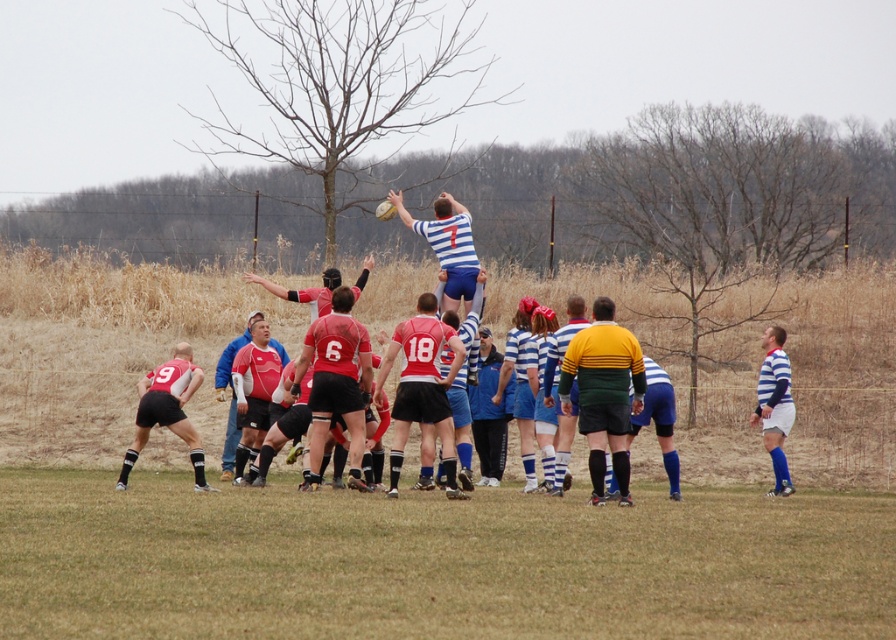
Based on the photo, can you confirm if striped jersey at center is wider than striped jersey at right?

Correct, the width of striped jersey at center exceeds that of striped jersey at right.

Does striped jersey at center appear on the right side of striped jersey at right?

In fact, striped jersey at center is to the left of striped jersey at right.

Which is behind, point (454, 225) or point (785, 483)?

Point (454, 225)

At what (x,y) coordinates should I click in order to perform the action: click on striped jersey at center. Please return your answer as a coordinate pair (x, y). This screenshot has width=896, height=640. Looking at the image, I should click on (448, 244).

Which is in front, point (619, 449) or point (174, 372)?

Point (619, 449) is more forward.

Does yellow-green striped jersey at center have a larger size compared to matte red jersey at lower left?

Yes.

Between point (591, 432) and point (173, 372), which one is positioned behind?

Point (173, 372)

Locate an element on the screen. The image size is (896, 640). yellow-green striped jersey at center is located at coordinates (604, 394).

Who is higher up, yellow-green striped jersey at center or striped jersey at center?

striped jersey at center

Who is taller, yellow-green striped jersey at center or striped jersey at center?

With more height is yellow-green striped jersey at center.

At what (x,y) coordinates should I click in order to perform the action: click on yellow-green striped jersey at center. Please return your answer as a coordinate pair (x, y). The image size is (896, 640). Looking at the image, I should click on (604, 394).

I want to click on yellow-green striped jersey at center, so click(604, 394).